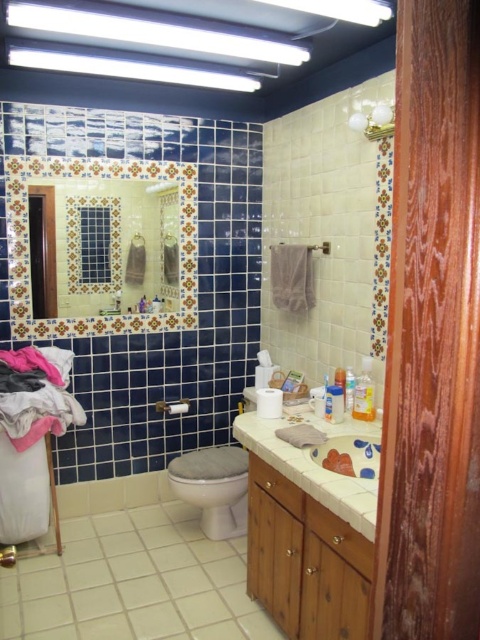
Which is above, wooden cabinet at lower center or translucent plastic soap dispenser at upper center?

translucent plastic soap dispenser at upper center

Consider the image. Is wooden cabinet at lower center closer to camera compared to translucent plastic soap dispenser at upper center?

That is True.

Does point (348, 508) come in front of point (345, 401)?

Yes, point (348, 508) is closer to viewer.

Find the location of a particular element. This screenshot has height=640, width=480. wooden cabinet at lower center is located at coordinates (303, 540).

Based on the photo, does wooden cabinet at lower center appear on the right side of translucent plastic soap at center?

Incorrect, wooden cabinet at lower center is not on the right side of translucent plastic soap at center.

Is wooden cabinet at lower center wider than translucent plastic soap at center?

Yes, wooden cabinet at lower center is wider than translucent plastic soap at center.

Is point (279, 477) positioned after point (365, 372)?

No, (279, 477) is closer to viewer.

This screenshot has height=640, width=480. I want to click on wooden cabinet at lower center, so click(303, 540).

Is white glossy toilet at center below translucent plastic soap at center?

Correct, white glossy toilet at center is located below translucent plastic soap at center.

Image resolution: width=480 pixels, height=640 pixels. What are the coordinates of `white glossy toilet at center` in the screenshot? It's located at (214, 486).